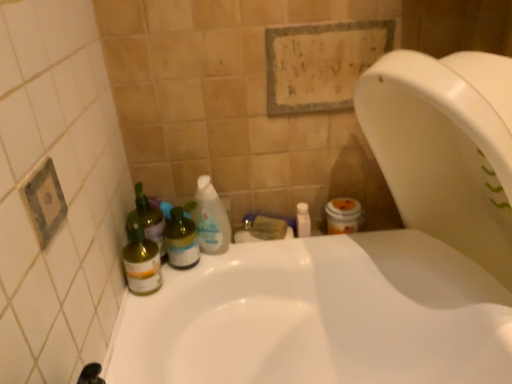
Question: From a real-world perspective, is green glass bottle at left, arranged as the second bottle when viewed from the left, over translucent plastic bottle at center, placed as the 2th cleaning product when sorted from left to right?

Choices:
 (A) yes
 (B) no

Answer: (B)

Question: From the image's perspective, is green glass bottle at left, positioned as the first bottle in right-to-left order, under translucent plastic bottle at center, placed as the 2th cleaning product when sorted from left to right?

Choices:
 (A) no
 (B) yes

Answer: (B)

Question: Are green glass bottle at left, positioned as the first bottle in right-to-left order, and translucent plastic bottle at center, placed as the 2th cleaning product when sorted from left to right, located far from each other?

Choices:
 (A) no
 (B) yes

Answer: (A)

Question: Considering the relative sizes of green glass bottle at left, positioned as the first bottle in right-to-left order, and translucent plastic bottle at center, which is the first cleaning product in right-to-left order, in the image provided, is green glass bottle at left, positioned as the first bottle in right-to-left order, smaller than translucent plastic bottle at center, which is the first cleaning product in right-to-left order,?

Choices:
 (A) no
 (B) yes

Answer: (B)

Question: From a real-world perspective, is green glass bottle at left, arranged as the second bottle when viewed from the left, physically below translucent plastic bottle at center, placed as the 2th cleaning product when sorted from left to right?

Choices:
 (A) yes
 (B) no

Answer: (A)

Question: Could you tell me if green glass bottle at left, positioned as the first bottle in right-to-left order, is facing translucent plastic bottle at center, placed as the 2th cleaning product when sorted from left to right?

Choices:
 (A) no
 (B) yes

Answer: (A)

Question: Can you confirm if translucent green bottle at left, positioned as the 2th bottle in right-to-left order, is thinner than white glossy bottle at upper center?

Choices:
 (A) yes
 (B) no

Answer: (B)

Question: From the image's perspective, is translucent green bottle at left, positioned as the 2th bottle in right-to-left order, below white glossy bottle at upper center?

Choices:
 (A) no
 (B) yes

Answer: (B)

Question: Is translucent green bottle at left, positioned as the 2th bottle in right-to-left order, at the right side of white glossy bottle at upper center?

Choices:
 (A) no
 (B) yes

Answer: (A)

Question: Considering the relative sizes of translucent green bottle at left, the first bottle positioned from the left, and white glossy bottle at upper center in the image provided, is translucent green bottle at left, the first bottle positioned from the left, smaller than white glossy bottle at upper center?

Choices:
 (A) no
 (B) yes

Answer: (A)

Question: Considering the relative sizes of translucent green bottle at left, the first bottle positioned from the left, and white glossy bottle at upper center in the image provided, is translucent green bottle at left, the first bottle positioned from the left, wider than white glossy bottle at upper center?

Choices:
 (A) yes
 (B) no

Answer: (A)

Question: Is translucent green bottle at left, the first bottle positioned from the left, at the left side of white glossy bottle at upper center?

Choices:
 (A) no
 (B) yes

Answer: (B)

Question: Does translucent green bottle at left, the first bottle positioned from the left, lie behind green glass bottle at left, positioned as the first bottle in right-to-left order?

Choices:
 (A) yes
 (B) no

Answer: (B)